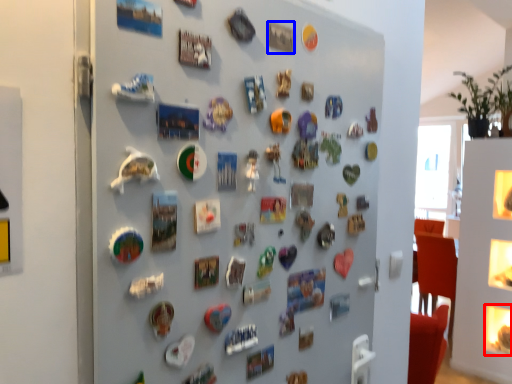
Question: Which object is further to the camera taking this photo, button (highlighted by a red box) or button (highlighted by a blue box)?

Choices:
 (A) button
 (B) button

Answer: (A)